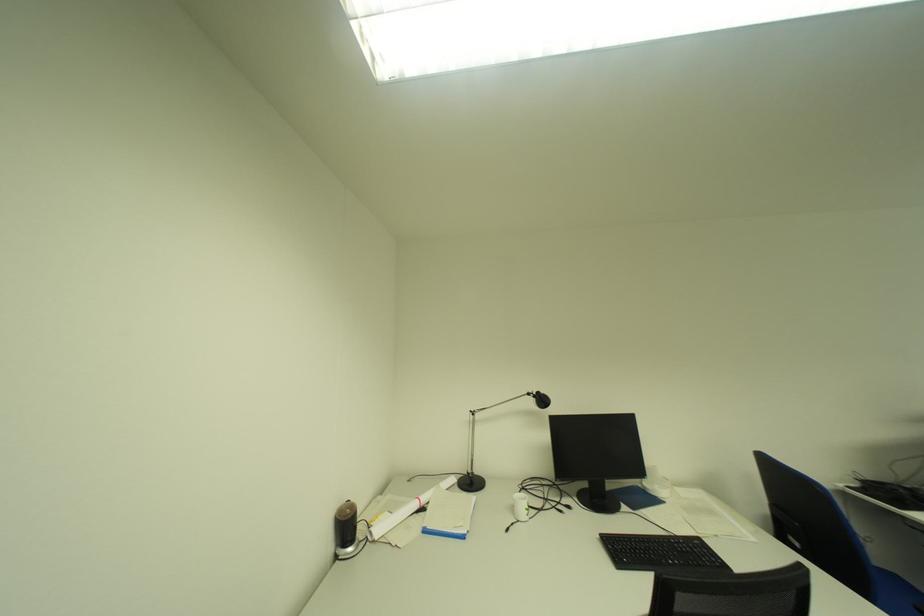
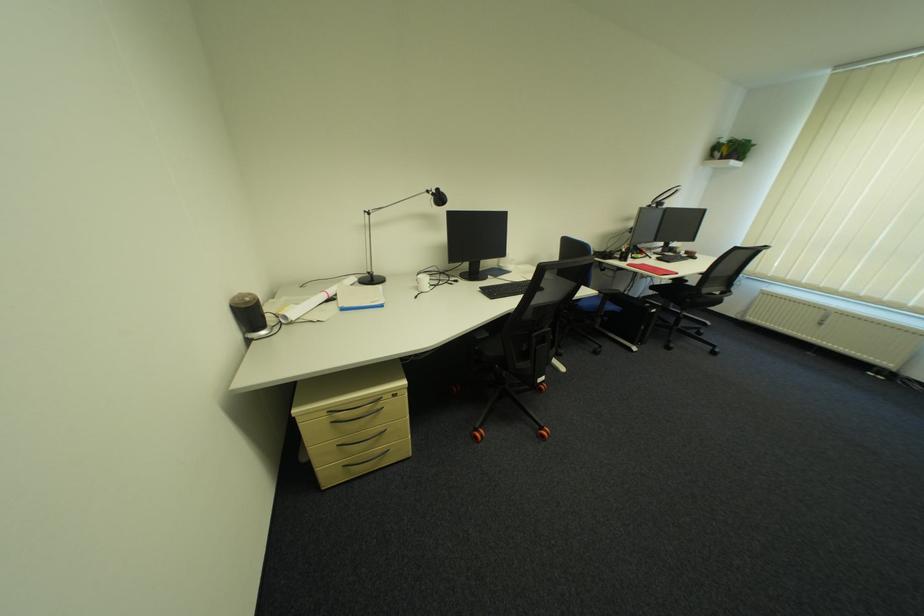
Locate, in the second image, the point that corresponds to [346,546] in the first image.

(253, 334)